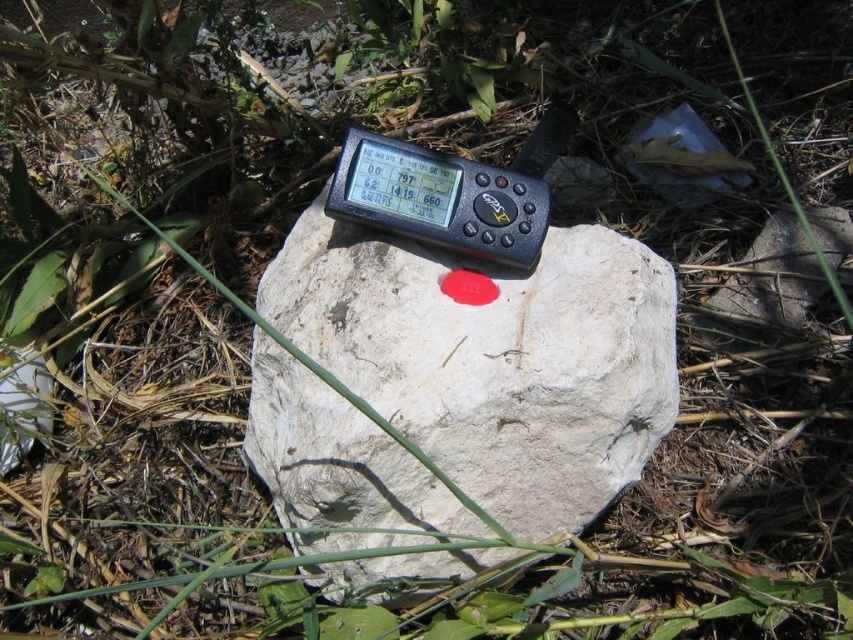
You are a hiker trying to read the black plastic thermometer at center. There is a white rough rock at center blocking your view. Can you see the thermometer clearly?

The white rough rock at center is in front of the black plastic thermometer at center, so the rock is blocking your view of the thermometer.

You are using a GPS device placed on the white rough rock at center. The GPS screen shows coordinates like 00797, 62, 1419, and 660. If you need to move the GPS to a new location at point 0.600, 0.600, how far in the x and y direction do you need to move it?

The white rough rock at center is located at point [494,358]. To move it to [511,384], you need to move it 0.038 units in the x direction and 0.020 units in the y direction.